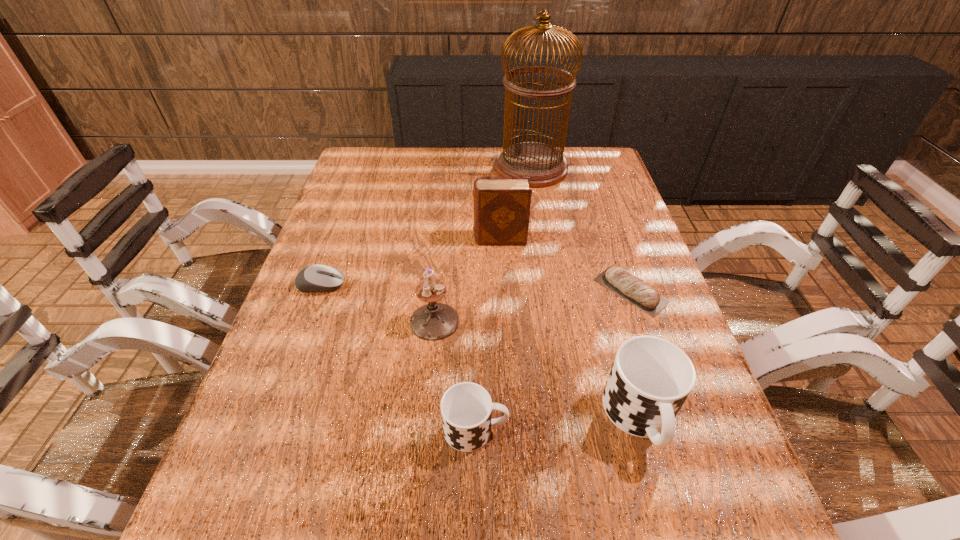
This screenshot has width=960, height=540. I want to click on free region that satisfies the following two spatial constraints: 1. on the side of the right cup with the handle; 2. on the side of the fifth tallest object with the handle, so click(643, 429).

Where is `free space in the image that satisfies the following two spatial constraints: 1. on the front-facing side of the birdcage; 2. on the back side of the pita bread`? This screenshot has width=960, height=540. free space in the image that satisfies the following two spatial constraints: 1. on the front-facing side of the birdcage; 2. on the back side of the pita bread is located at coordinates (552, 291).

Locate an element on the screen. The image size is (960, 540). vacant space that satisfies the following two spatial constraints: 1. on the spine side of the pita bread; 2. on the left side of the sixth nearest object is located at coordinates (502, 291).

Identify the location of vacant space that satisfies the following two spatial constraints: 1. on the back side of the pita bread; 2. on the right side of the candle holder. (438, 291).